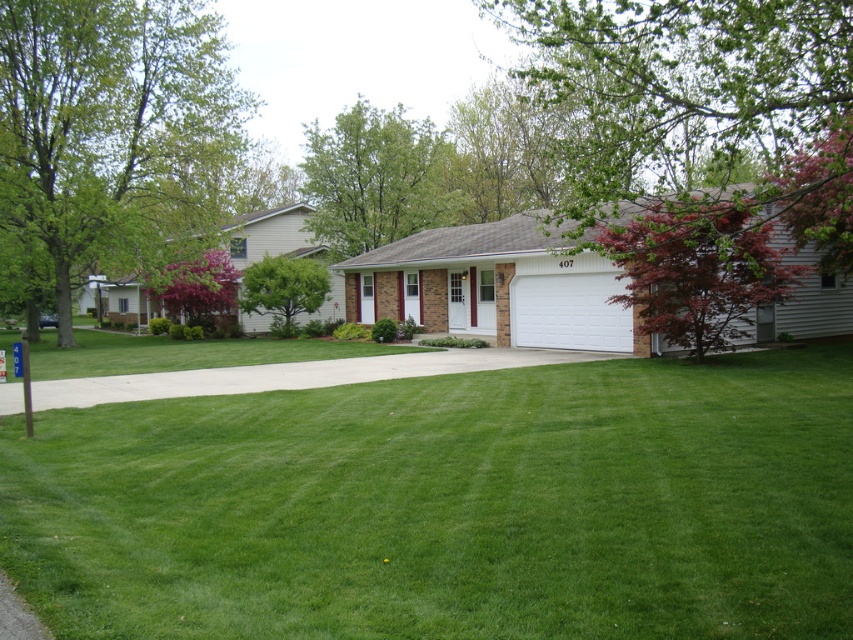
Question: Which object appears farthest from the camera in this image?

Choices:
 (A) green leafy tree at center
 (B) pink flowering bush at center
 (C) concrete at center
 (D) green grass at center

Answer: (A)

Question: Can you confirm if white matte garage at center is positioned below green leafy tree at center?

Choices:
 (A) yes
 (B) no

Answer: (A)

Question: Considering the relative positions of green grass at center and green leafy tree at upper center in the image provided, where is green grass at center located with respect to green leafy tree at upper center?

Choices:
 (A) left
 (B) right

Answer: (B)

Question: Is green grass at center below green leafy tree at upper center?

Choices:
 (A) yes
 (B) no

Answer: (A)

Question: Among these points, which one is farthest from the camera?

Choices:
 (A) (258, 275)
 (B) (573, 355)

Answer: (A)

Question: Among these objects, which one is nearest to the camera?

Choices:
 (A) reddish-brown bark tree at right
 (B) green leafy tree at upper center
 (C) white matte garage at center
 (D) concrete at center

Answer: (A)